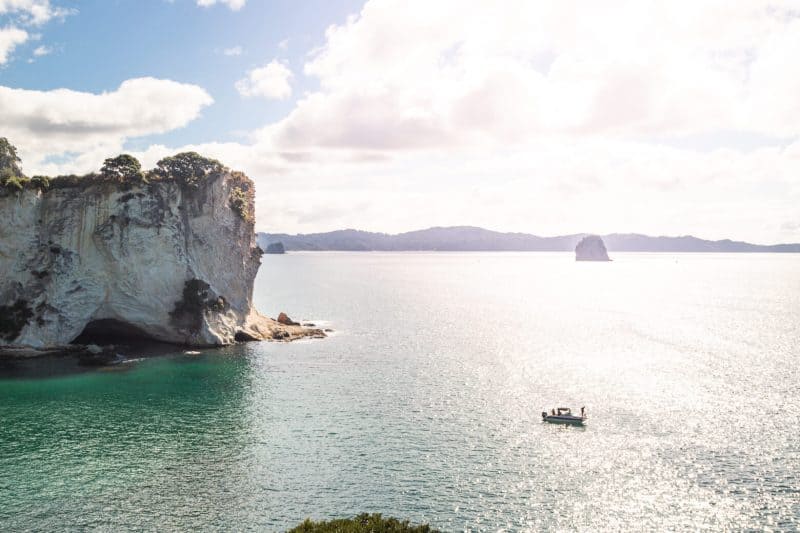
The image size is (800, 533). Identify the location of island. (586, 250).